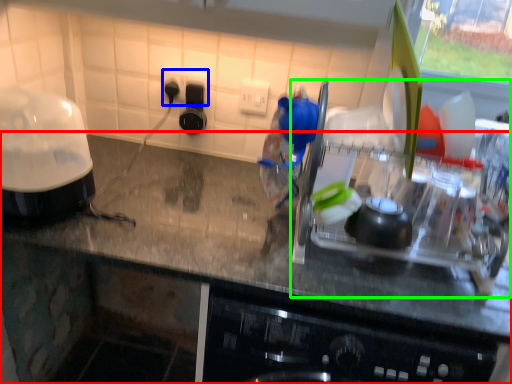
Question: Based on their relative distances, which object is farther from countertop (highlighted by a red box)? Choose from electric outlet (highlighted by a blue box) and appliance (highlighted by a green box).

Choices:
 (A) electric outlet
 (B) appliance

Answer: (A)